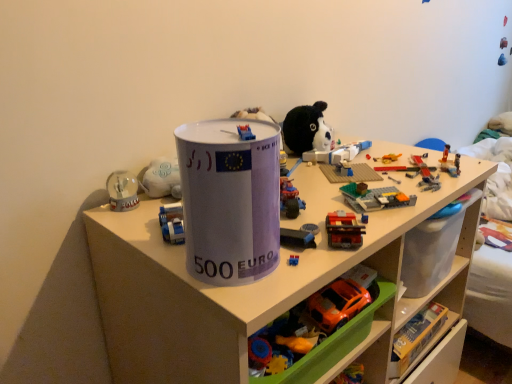
Image resolution: width=512 pixels, height=384 pixels. Find the location of `vacant space to the right of rubberized plastic toy car at center, which is the 1th toy from top to bottom`. vacant space to the right of rubberized plastic toy car at center, which is the 1th toy from top to bottom is located at coordinates (360, 196).